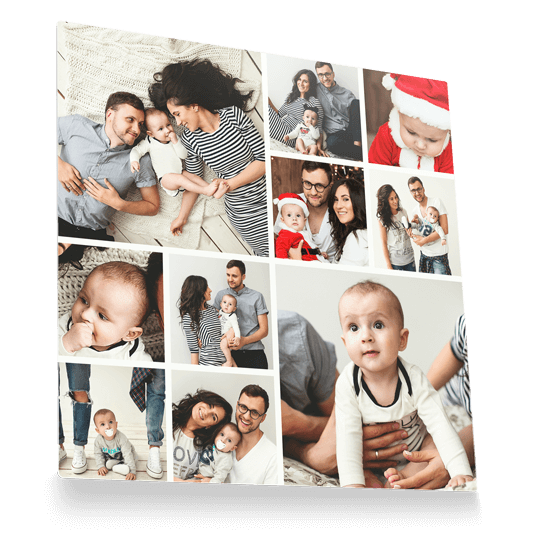
Locate an element on the screen. photos in collage is located at coordinates (167, 113), (292, 102), (312, 200), (410, 202), (412, 99), (395, 360), (246, 324), (143, 314), (139, 411), (203, 411).